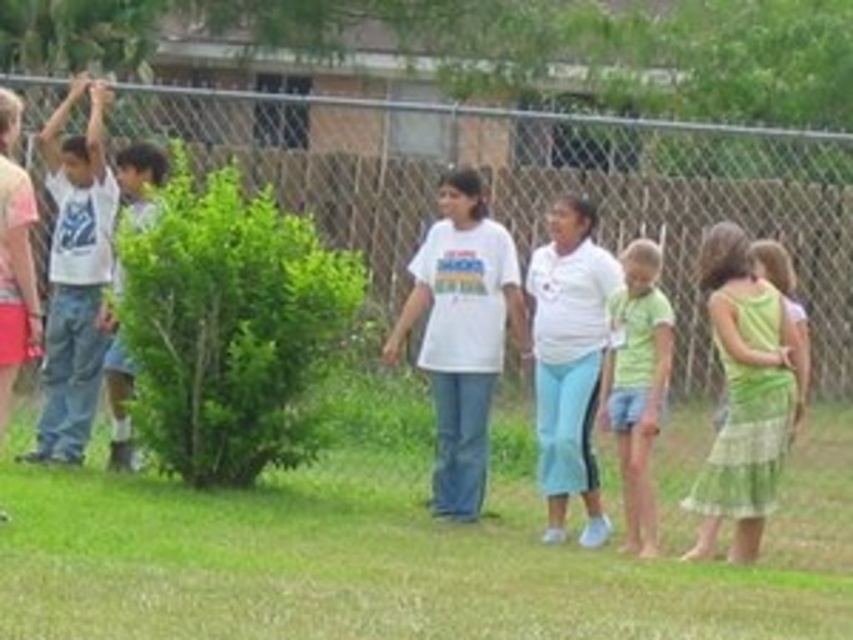
You are a photographer setting up for a group photo in the park. You notice the green striped dress at right and the white cotton shirt at left. Which clothing item should you position lower in your camera frame to ensure both are visible?

The green striped dress at right is below the white cotton shirt at left, so you should position the green striped dress at right lower in the frame to ensure both are visible.